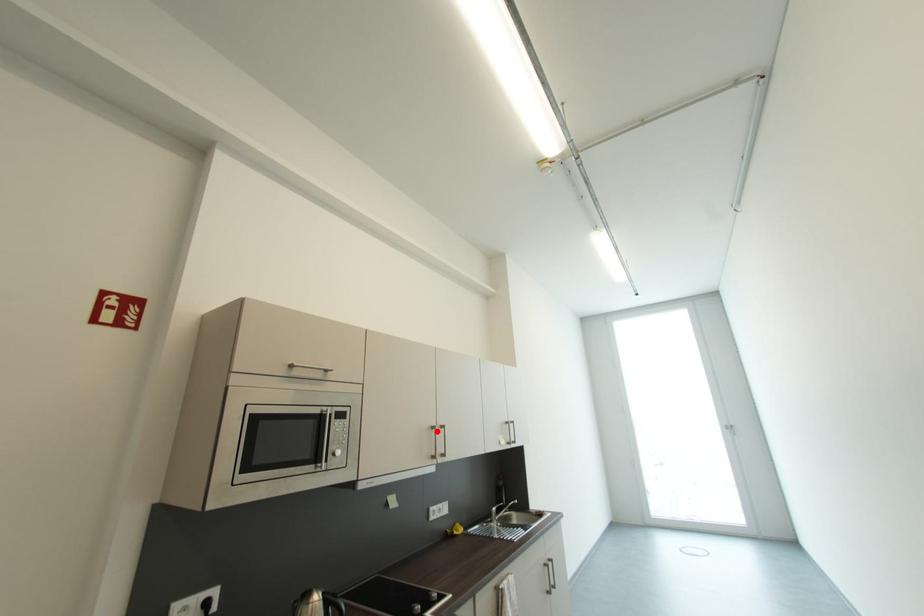
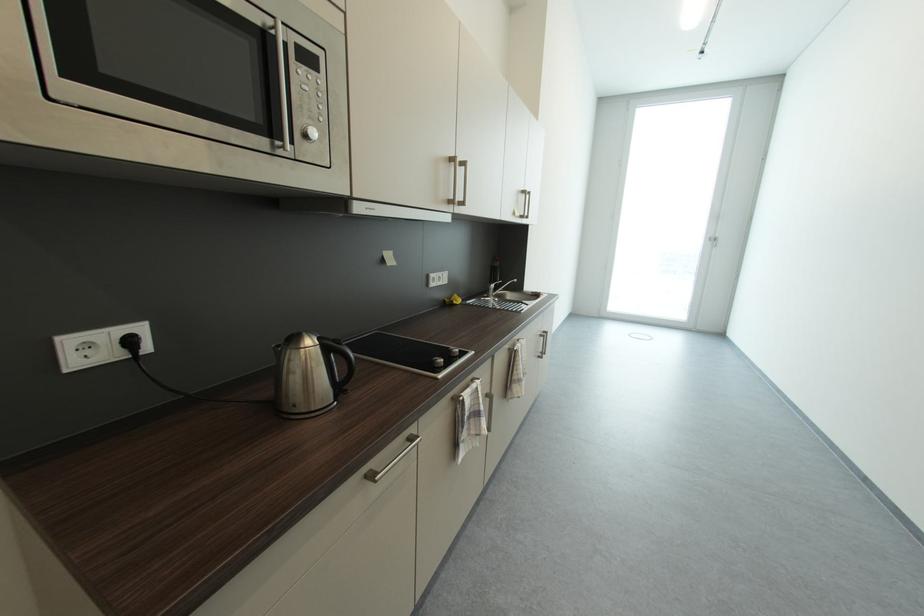
The point at the highlighted location is marked in the first image. Where is the corresponding point in the second image?

(455, 164)